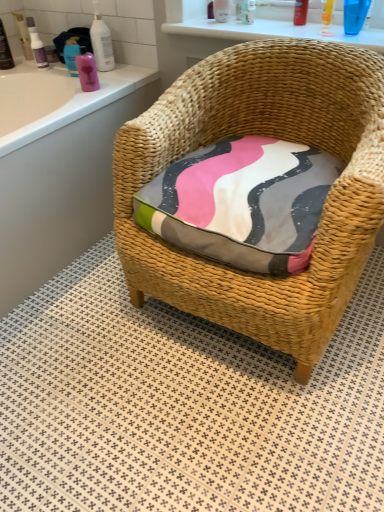
Image resolution: width=384 pixels, height=512 pixels. In order to click on blank space to the left of woven wicker chair at center in this screenshot , I will do `click(77, 351)`.